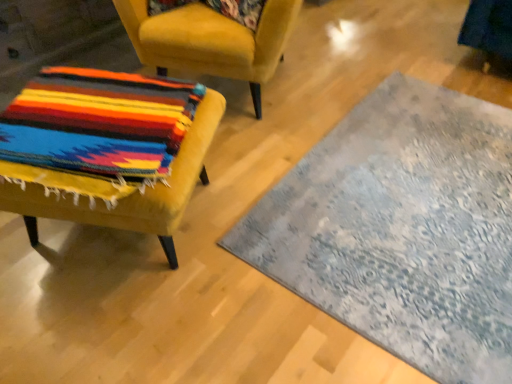
At what (x,y) coordinates should I click in order to perform the action: click on free space in front of velvet yellow chair at left, the 1th chair from the bottom. Please return your answer as a coordinate pair (x, y). This screenshot has width=512, height=384. Looking at the image, I should click on (118, 326).